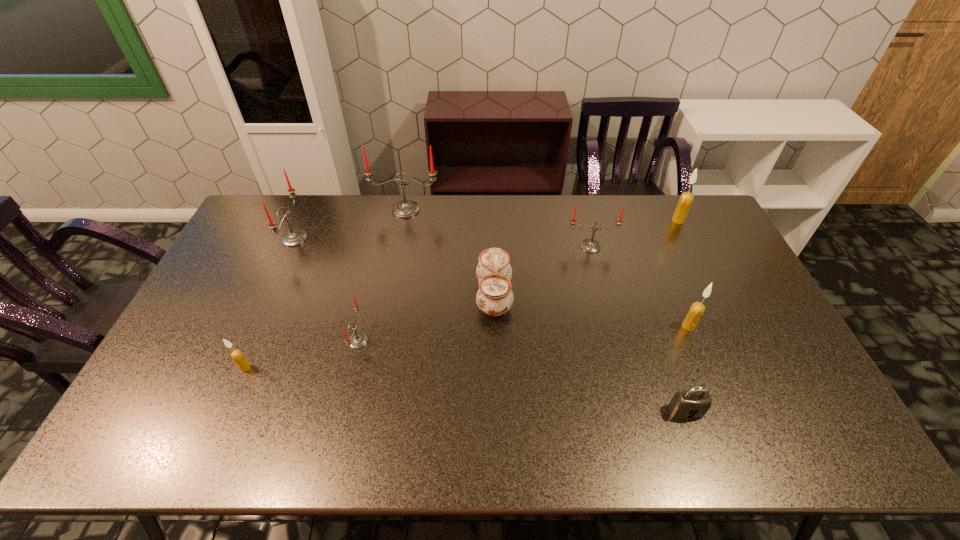
Where is `white chinaware`? The image size is (960, 540). white chinaware is located at coordinates (494, 297).

At what (x,y) coordinates should I click in order to perform the action: click on the nearest cream candle. Please return your answer as a coordinate pair (x, y). The width and height of the screenshot is (960, 540). Looking at the image, I should click on (237, 355).

Locate an element on the screen. The height and width of the screenshot is (540, 960). the nearest candle is located at coordinates (237, 355).

Locate an element on the screen. This screenshot has width=960, height=540. the smallest red candle is located at coordinates (358, 340).

You are a GUI agent. You are given a task and a screenshot of the screen. Output one action in this format:
    pyautogui.click(x=<x>, y=<y>)
    Task: Click on the padlock
    
    Given the screenshot: What is the action you would take?
    pyautogui.click(x=694, y=403)

At what (x,y) coordinates should I click in order to perform the action: click on the shortest object. Please return your answer as a coordinate pair (x, y). Looking at the image, I should click on (694, 403).

You are a GUI agent. You are given a task and a screenshot of the screen. Output one action in this format:
    pyautogui.click(x=<x>, y=<y>)
    Task: Click on the vacant region located 0.350m on the front-facing side of the farthest red candle
    The height and width of the screenshot is (540, 960).
    Given the screenshot: What is the action you would take?
    pyautogui.click(x=391, y=288)

Find the location of a particular element. The width and height of the screenshot is (960, 540). free space located on the front of the rightmost candle is located at coordinates (692, 248).

Locate an element on the screen. vacant space located on the front-facing side of the second biggest red candle is located at coordinates (329, 238).

The height and width of the screenshot is (540, 960). Identify the location of free location located 0.120m on the front-facing side of the third candle from right to left. (599, 279).